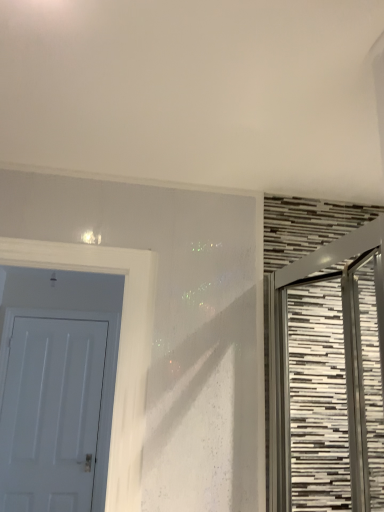
Question: Is metallic textured door at right, which appears as the 2th door when viewed from the back, inside the boundaries of white matte door at left, the first door positioned from the back, or outside?

Choices:
 (A) outside
 (B) inside

Answer: (A)

Question: Considering the positions of metallic textured door at right, the first door from the front, and white matte door at left, acting as the 2th door starting from the front, in the image, is metallic textured door at right, the first door from the front, taller or shorter than white matte door at left, acting as the 2th door starting from the front,?

Choices:
 (A) tall
 (B) short

Answer: (B)

Question: Relative to white matte door at left, which appears as the 1th door when viewed from the left, is metallic textured door at right, which appears as the 2th door when viewed from the back, in front or behind?

Choices:
 (A) behind
 (B) front

Answer: (B)

Question: From a real-world perspective, is white matte door at left, the first door positioned from the back, above or below metallic textured door at right, which appears as the 2th door when viewed from the back?

Choices:
 (A) below
 (B) above

Answer: (A)

Question: Looking at the image, does white matte door at left, which ranks as the 2th door in right-to-left order, seem bigger or smaller compared to metallic textured door at right, the first door from the front?

Choices:
 (A) small
 (B) big

Answer: (A)

Question: From the image's perspective, relative to metallic textured door at right, the 1th door in the right-to-left sequence, is white matte door at left, which ranks as the 2th door in right-to-left order, above or below?

Choices:
 (A) above
 (B) below

Answer: (B)

Question: Relative to metallic textured door at right, which appears as the 2th door when viewed from the back, is white matte door at left, which ranks as the 2th door in right-to-left order, in front or behind?

Choices:
 (A) front
 (B) behind

Answer: (B)